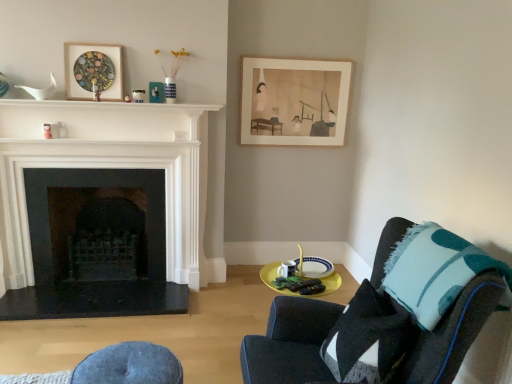
What are the coordinates of `free space above wooden stained picture frame at upper left, arranged as the 3th picture frame when viewed from the back (from a real-world perspective)` in the screenshot? It's located at (96, 47).